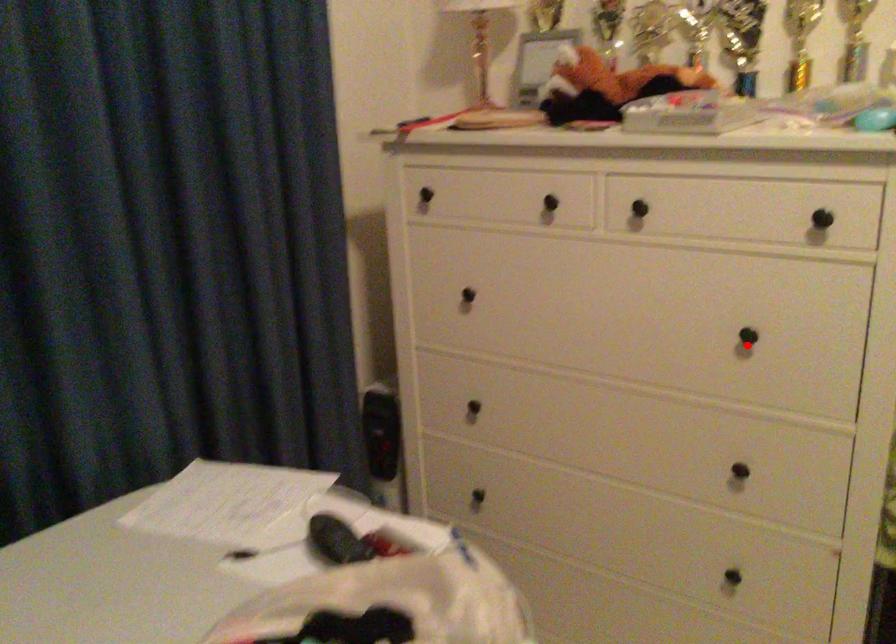
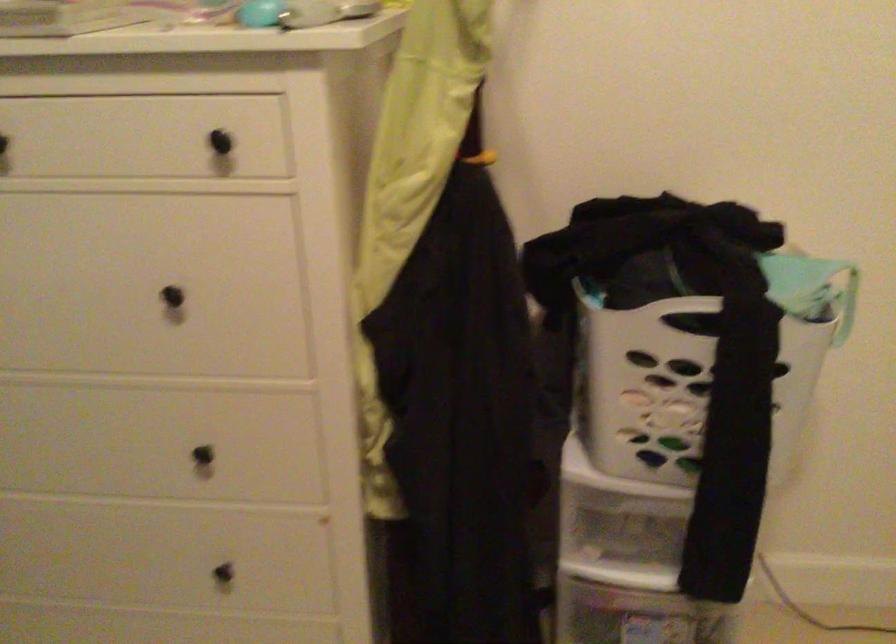
Find the pixel in the second image that matches the highlighted location in the first image.

(178, 305)